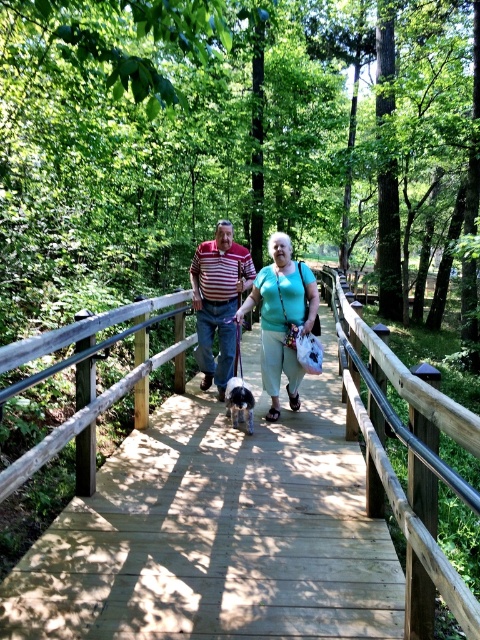
Who is positioned more to the right, wooden bridge at center or green matte shirt at center?

From the viewer's perspective, green matte shirt at center appears more on the right side.

Which is above, wooden bridge at center or green matte shirt at center?

green matte shirt at center

What do you see at coordinates (235, 534) in the screenshot? The height and width of the screenshot is (640, 480). I see `wooden bridge at center` at bounding box center [235, 534].

Find the location of a particular element. wooden bridge at center is located at coordinates (235, 534).

Is point (289, 433) positioned after point (228, 406)?

No, (289, 433) is closer to viewer.

Is wooden bridge at center further to camera compared to fluffy white dog at center?

No, wooden bridge at center is closer to the viewer.

Image resolution: width=480 pixels, height=640 pixels. What do you see at coordinates (235, 534) in the screenshot?
I see `wooden bridge at center` at bounding box center [235, 534].

The width and height of the screenshot is (480, 640). Find the location of `wooden bridge at center`. wooden bridge at center is located at coordinates (235, 534).

Does green matte shirt at center have a greater height compared to striped cotton shirt at center?

No.

What do you see at coordinates (282, 317) in the screenshot? I see `green matte shirt at center` at bounding box center [282, 317].

Is point (272, 310) in front of point (208, 371)?

Yes, it is.

Image resolution: width=480 pixels, height=640 pixels. I want to click on green matte shirt at center, so click(282, 317).